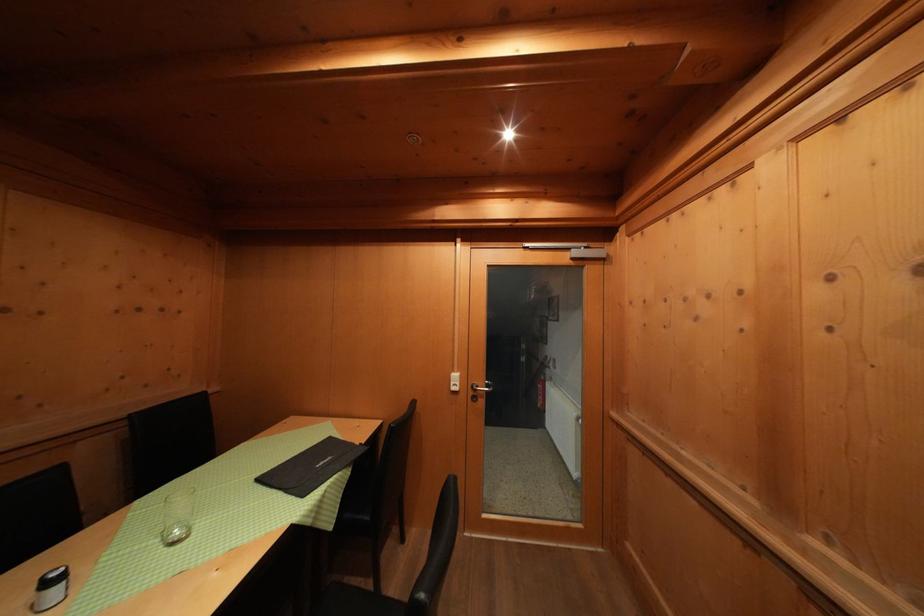
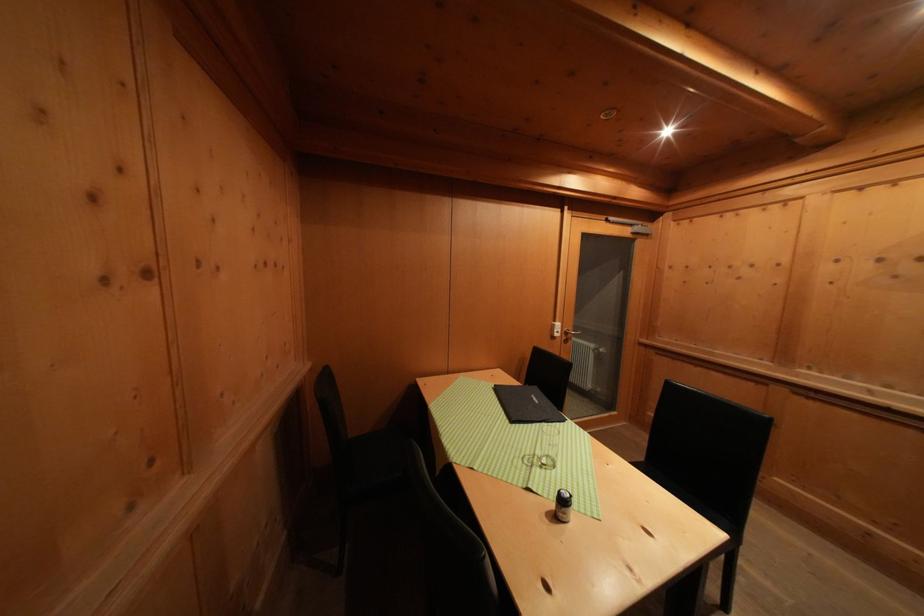
Where in the second image is the point corresponding to (326,469) from the first image?

(542, 406)